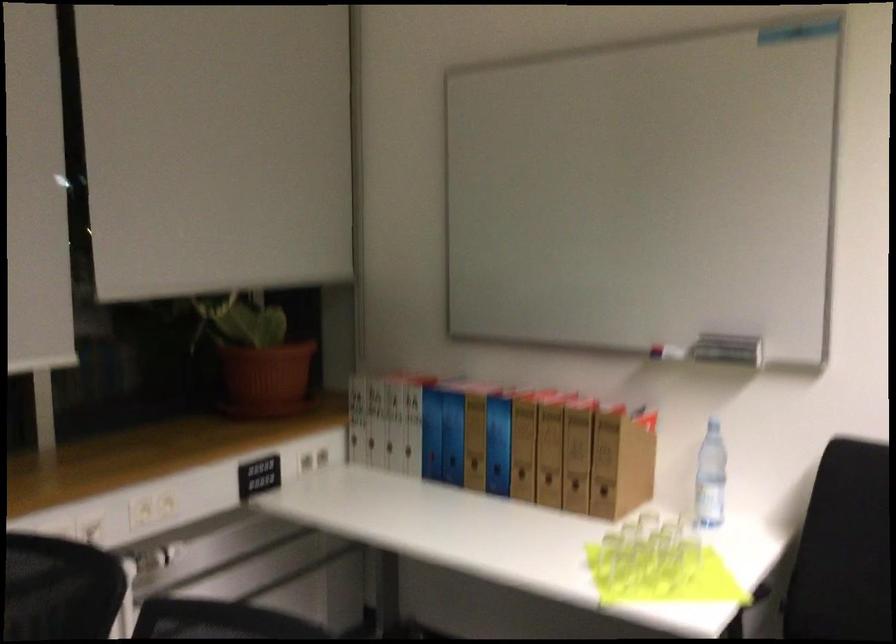
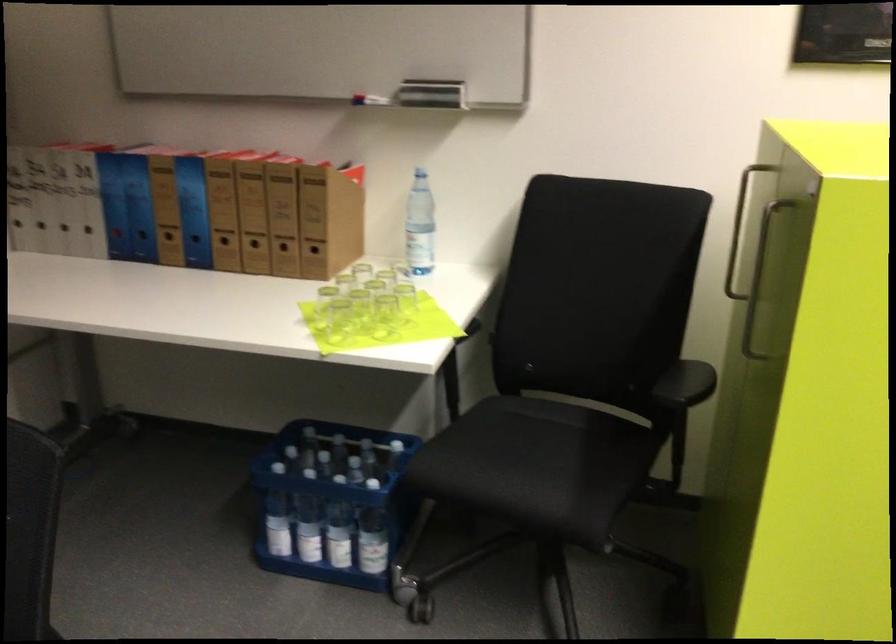
Find the pixel in the second image that matches [521,475] in the first image.

(225, 245)